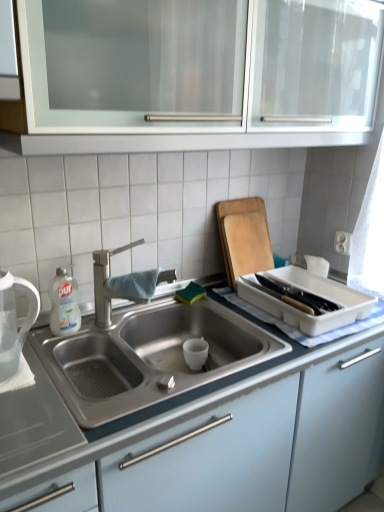
The height and width of the screenshot is (512, 384). In order to click on vacant area that lies to the right of white glossy bottle at left in this screenshot , I will do `click(108, 323)`.